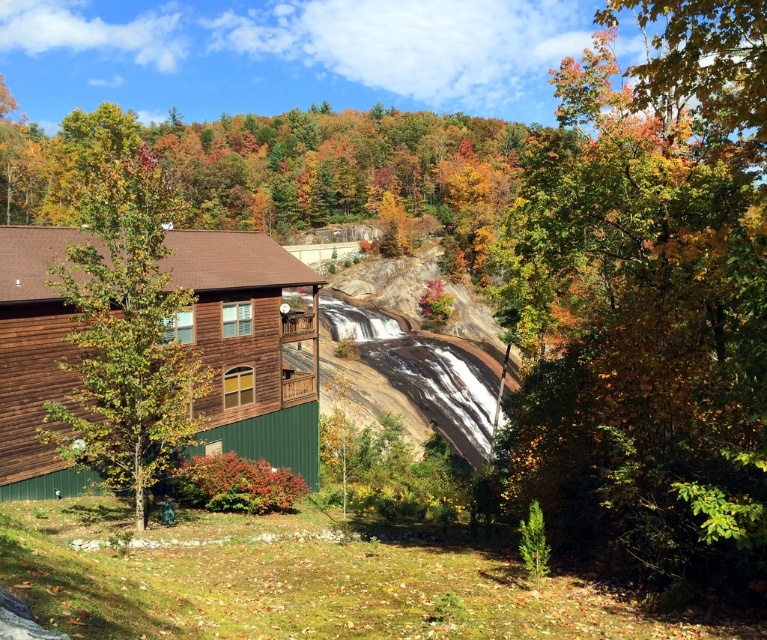
You are standing at the base of the rocky hillside in the autumnal scene. You notice two points marked on the image. From your perspective, which point is closer to you? The points are labeled as point (x=45, y=337) and point (x=87, y=275).

Point (x=87, y=275) is closer to you because it is in front of point (x=45, y=337) according to the description.

You are standing in front of the wooden cabin and notice a point marked at coordinates (649, 298). Based on the scene description, what is located at that point?

The point at coordinates (649, 298) indicates autumn leaves at the right side of the scene.

You are standing in front of the wooden cabin and notice the autumn leaves at right and the green matte tree at center. Which object appears taller in the scene?

The autumn leaves at right is much taller than the green matte tree at center.